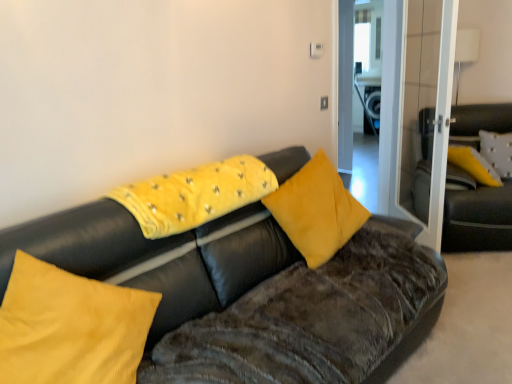
What do you see at coordinates (195, 195) in the screenshot? This screenshot has height=384, width=512. I see `yellow velvet pillow at center, acting as the 3th pillow starting from the right` at bounding box center [195, 195].

At what (x,y) coordinates should I click in order to perform the action: click on velvet yellow pillow at center, the first pillow viewed from the left. Please return your answer as a coordinate pair (x, y). This screenshot has width=512, height=384. Looking at the image, I should click on (70, 327).

This screenshot has height=384, width=512. In order to click on yellow velvet pillow at center, acting as the 2th pillow starting from the left in this screenshot , I will do `click(195, 195)`.

Would you say transparent glass door at right is a long distance from velvet black couch at right, the second studio couch from the left?

transparent glass door at right is near velvet black couch at right, the second studio couch from the left, not far away.

Is transparent glass door at right bigger than velvet black couch at right, which appears as the first studio couch when viewed from the right?

No, transparent glass door at right is not bigger than velvet black couch at right, which appears as the first studio couch when viewed from the right.

Is transparent glass door at right oriented towards velvet black couch at right, which ranks as the 1th studio couch in back-to-front order?

Yes, transparent glass door at right is turned towards velvet black couch at right, which ranks as the 1th studio couch in back-to-front order.

Which object is closer to the camera taking this photo, transparent glass door at right or velvet black couch at right, which is counted as the second studio couch, starting from the front?

transparent glass door at right.

In the image, is velvet black couch at center, the first studio couch from the left, on the left side or the right side of transparent glass door at right?

In the image, velvet black couch at center, the first studio couch from the left, appears on the left side of transparent glass door at right.

Does velvet black couch at center, the first studio couch positioned from the front, have a greater height compared to transparent glass door at right?

In fact, velvet black couch at center, the first studio couch positioned from the front, may be shorter than transparent glass door at right.

Is the surface of velvet black couch at center, the first studio couch from the left, in direct contact with transparent glass door at right?

velvet black couch at center, the first studio couch from the left, is not next to transparent glass door at right, and they're not touching.

Considering the relative sizes of yellow velvet pillow at center, acting as the 3th pillow starting from the right, and velvet black couch at right, which ranks as the 1th studio couch in back-to-front order, in the image provided, is yellow velvet pillow at center, acting as the 3th pillow starting from the right, bigger than velvet black couch at right, which ranks as the 1th studio couch in back-to-front order,?

No.

From the image's perspective, which one is positioned lower, yellow velvet pillow at center, acting as the 3th pillow starting from the right, or velvet black couch at right, which is counted as the second studio couch, starting from the front?

yellow velvet pillow at center, acting as the 3th pillow starting from the right.

In the image, is yellow velvet pillow at center, placed as the third pillow when sorted from back to front, positioned in front of or behind velvet black couch at right, which ranks as the 1th studio couch in back-to-front order?

Visually, yellow velvet pillow at center, placed as the third pillow when sorted from back to front, is located in front of velvet black couch at right, which ranks as the 1th studio couch in back-to-front order.

Could you tell me if velvet yellow pillow at center, which is the 4th pillow from right to left, is turned towards velvet black couch at center, positioned as the second studio couch in back-to-front order?

Yes, velvet yellow pillow at center, which is the 4th pillow from right to left, is turned towards velvet black couch at center, positioned as the second studio couch in back-to-front order.

Is velvet yellow pillow at center, the first pillow viewed from the left, next to velvet black couch at center, the first studio couch positioned from the front, and touching it?

No, velvet yellow pillow at center, the first pillow viewed from the left, is not with velvet black couch at center, the first studio couch positioned from the front.

In the image, is velvet yellow pillow at center, which ranks as the first pillow in front-to-back order, positioned in front of or behind velvet black couch at center, positioned as the second studio couch in back-to-front order?

velvet yellow pillow at center, which ranks as the first pillow in front-to-back order, is positioned farther from the viewer than velvet black couch at center, positioned as the second studio couch in back-to-front order.

From a real-world perspective, is velvet yellow pillow at center, which ranks as the first pillow in front-to-back order, positioned above or below velvet black couch at center, the first studio couch positioned from the front?

From a real-world perspective, velvet yellow pillow at center, which ranks as the first pillow in front-to-back order, is physically above velvet black couch at center, the first studio couch positioned from the front.

Is transparent glass door at right oriented away from velvet yellow pillow at center, which is counted as the 3th pillow, starting from the left?

No, transparent glass door at right's orientation is not away from velvet yellow pillow at center, which is counted as the 3th pillow, starting from the left.

From the image's perspective, would you say transparent glass door at right is shown under velvet yellow pillow at center, the second pillow viewed from the back?

Incorrect, from the image's perspective, transparent glass door at right is higher than velvet yellow pillow at center, the second pillow viewed from the back.

From a real-world perspective, is transparent glass door at right above or below velvet yellow pillow at center, positioned as the second pillow in right-to-left order?

In terms of real-world spatial position, transparent glass door at right is above velvet yellow pillow at center, positioned as the second pillow in right-to-left order.

Is transparent glass door at right in front of or behind velvet yellow pillow at center, the second pillow viewed from the back, in the image?

In the image, transparent glass door at right appears behind velvet yellow pillow at center, the second pillow viewed from the back.

Is transparent glass door at right further to camera compared to yellow fabric pillow at upper right, placed as the first pillow when sorted from back to front?

No, transparent glass door at right is in front of yellow fabric pillow at upper right, placed as the first pillow when sorted from back to front.

What's the angular difference between transparent glass door at right and yellow fabric pillow at upper right, acting as the 4th pillow starting from the left,'s facing directions?

The facing directions of transparent glass door at right and yellow fabric pillow at upper right, acting as the 4th pillow starting from the left, are 115 degrees apart.

Considering the relative sizes of transparent glass door at right and yellow fabric pillow at upper right, placed as the 4th pillow when sorted from front to back, in the image provided, is transparent glass door at right taller than yellow fabric pillow at upper right, placed as the 4th pillow when sorted from front to back,?

Yes.

From the image's perspective, which is above, transparent glass door at right or yellow fabric pillow at upper right, acting as the 4th pillow starting from the left?

transparent glass door at right, from the image's perspective.

From the image's perspective, is velvet yellow pillow at center, the first pillow viewed from the left, under yellow velvet pillow at center, which appears as the 2th pillow when viewed from the front?

Yes, from the image's perspective, velvet yellow pillow at center, the first pillow viewed from the left, is below yellow velvet pillow at center, which appears as the 2th pillow when viewed from the front.

Is the depth of velvet yellow pillow at center, which ranks as the first pillow in front-to-back order, less than that of yellow velvet pillow at center, which appears as the 2th pillow when viewed from the front?

Yes, it is.

Is velvet yellow pillow at center, arranged as the 4th pillow when viewed from the back, far away from yellow velvet pillow at center, which appears as the 2th pillow when viewed from the front?

No.

Considering the relative positions of velvet yellow pillow at center, arranged as the 4th pillow when viewed from the back, and yellow velvet pillow at center, placed as the third pillow when sorted from back to front, in the image provided, is velvet yellow pillow at center, arranged as the 4th pillow when viewed from the back, to the left of yellow velvet pillow at center, placed as the third pillow when sorted from back to front, from the viewer's perspective?

Yes, velvet yellow pillow at center, arranged as the 4th pillow when viewed from the back, is to the left of yellow velvet pillow at center, placed as the third pillow when sorted from back to front.

Where is `glass door in front of the velvet black couch at right, which appears as the first studio couch when viewed from the right`? glass door in front of the velvet black couch at right, which appears as the first studio couch when viewed from the right is located at coordinates (416, 104).

You are a GUI agent. You are given a task and a screenshot of the screen. Output one action in this format:
    pyautogui.click(x=<x>, y=<y>)
    Task: Click on the studio couch that appears on the left of transparent glass door at right
    Image resolution: width=512 pixels, height=384 pixels.
    Given the screenshot: What is the action you would take?
    pyautogui.click(x=157, y=257)

When comparing their distances from velvet yellow pillow at center, which is counted as the 3th pillow, starting from the left, does velvet black couch at center, the second studio couch when ordered from right to left, or transparent glass door at right seem further?

transparent glass door at right.

Considering their positions, is yellow velvet pillow at center, acting as the 3th pillow starting from the right, positioned further to velvet yellow pillow at center, positioned as the second pillow in right-to-left order, than velvet black couch at center, the first studio couch from the left?

yellow velvet pillow at center, acting as the 3th pillow starting from the right, is positioned further to the anchor velvet yellow pillow at center, positioned as the second pillow in right-to-left order.

Which object lies further to the anchor point transparent glass door at right, yellow velvet pillow at center, placed as the third pillow when sorted from back to front, or velvet yellow pillow at center, placed as the third pillow when sorted from front to back?

yellow velvet pillow at center, placed as the third pillow when sorted from back to front, lies further to transparent glass door at right than the other object.

Estimate the real-world distances between objects in this image. Which object is closer to velvet yellow pillow at center, the second pillow viewed from the back, yellow velvet pillow at center, acting as the 2th pillow starting from the left, or yellow fabric pillow at upper right, which ranks as the first pillow in right-to-left order?

yellow velvet pillow at center, acting as the 2th pillow starting from the left.

When comparing their distances from velvet black couch at center, the second studio couch when ordered from right to left, does velvet yellow pillow at center, placed as the third pillow when sorted from front to back, or velvet black couch at right, which is counted as the second studio couch, starting from the front, seem further?

Among the two, velvet black couch at right, which is counted as the second studio couch, starting from the front, is located further to velvet black couch at center, the second studio couch when ordered from right to left.

Based on their spatial positions, is yellow velvet pillow at center, which appears as the 2th pillow when viewed from the front, or transparent glass door at right further from velvet yellow pillow at center, which is the 4th pillow from right to left?

The object further to velvet yellow pillow at center, which is the 4th pillow from right to left, is transparent glass door at right.

Which object lies further to the anchor point transparent glass door at right, velvet yellow pillow at center, placed as the third pillow when sorted from front to back, or yellow velvet pillow at center, placed as the third pillow when sorted from back to front?

yellow velvet pillow at center, placed as the third pillow when sorted from back to front, lies further to transparent glass door at right than the other object.

Considering their positions, is velvet yellow pillow at center, the first pillow viewed from the left, positioned further to yellow velvet pillow at center, acting as the 2th pillow starting from the left, than velvet black couch at right, which ranks as the 1th studio couch in back-to-front order?

The object further to yellow velvet pillow at center, acting as the 2th pillow starting from the left, is velvet black couch at right, which ranks as the 1th studio couch in back-to-front order.

You are a GUI agent. You are given a task and a screenshot of the screen. Output one action in this format:
    pyautogui.click(x=<x>, y=<y>)
    Task: Click on the pillow between velvet yellow pillow at center, which ranks as the first pillow in front-to-back order, and velvet yellow pillow at center, which is counted as the 3th pillow, starting from the left, along the z-axis
    The width and height of the screenshot is (512, 384).
    Given the screenshot: What is the action you would take?
    pyautogui.click(x=195, y=195)

Find the location of a particular element. The width and height of the screenshot is (512, 384). studio couch situated between yellow velvet pillow at center, acting as the 3th pillow starting from the right, and velvet black couch at right, the second studio couch from the left, from left to right is located at coordinates (157, 257).

Where is `studio couch between velvet yellow pillow at center, which is counted as the 3th pillow, starting from the left, and yellow fabric pillow at upper right, acting as the 4th pillow starting from the left, in the horizontal direction`? studio couch between velvet yellow pillow at center, which is counted as the 3th pillow, starting from the left, and yellow fabric pillow at upper right, acting as the 4th pillow starting from the left, in the horizontal direction is located at coordinates (476, 214).

Locate an element on the screen. The height and width of the screenshot is (384, 512). pillow between yellow velvet pillow at center, which appears as the 2th pillow when viewed from the front, and yellow fabric pillow at upper right, acting as the 4th pillow starting from the left, in the horizontal direction is located at coordinates (316, 210).